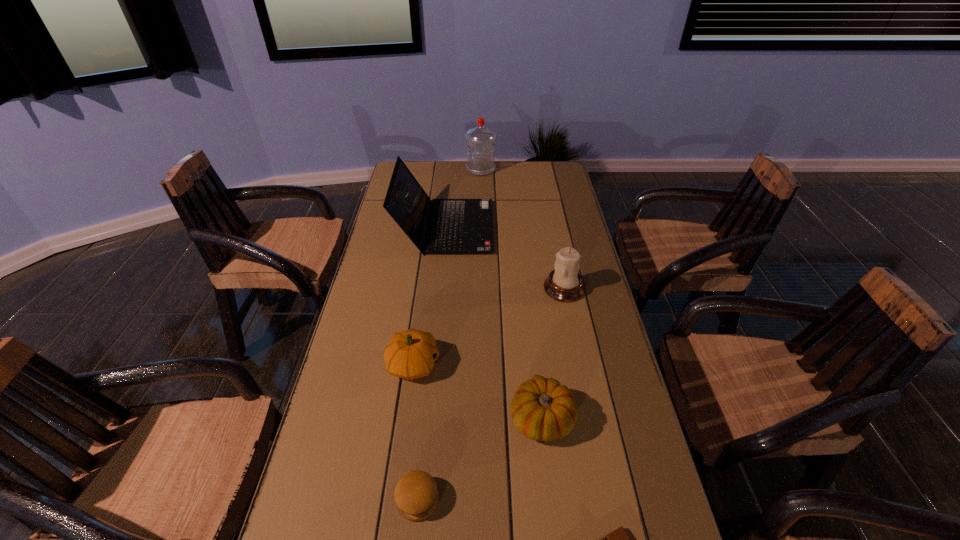
Locate an element on the screen. free space that satisfies the following two spatial constraints: 1. on the screen of the second farthest object; 2. on the left side of the candle holder is located at coordinates (440, 288).

You are a GUI agent. You are given a task and a screenshot of the screen. Output one action in this format:
    pyautogui.click(x=<x>, y=<y>)
    Task: Click on the vacant space that satisfies the following two spatial constraints: 1. on the side of the nearer gourd with the carved face; 2. on the left side of the farther gourd
    The width and height of the screenshot is (960, 540).
    Given the screenshot: What is the action you would take?
    pyautogui.click(x=406, y=418)

Where is `free location that satisfies the following two spatial constraints: 1. on the side of the taller gourd with the carved face; 2. on the right side of the nearer gourd`? The image size is (960, 540). free location that satisfies the following two spatial constraints: 1. on the side of the taller gourd with the carved face; 2. on the right side of the nearer gourd is located at coordinates (406, 418).